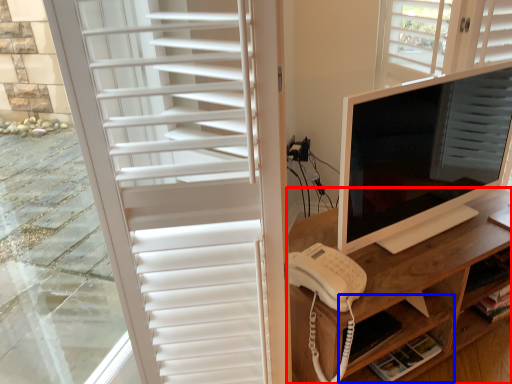
Question: Which point is closer to the camera, desk (highlighted by a red box) or shelf (highlighted by a blue box)?

Choices:
 (A) desk
 (B) shelf

Answer: (A)